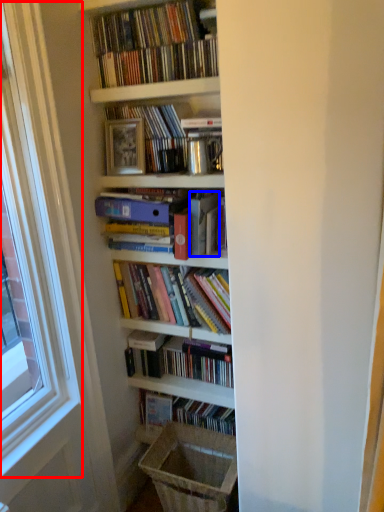
Question: Which of the following is the farthest to the observer, window frame (highlighted by a red box) or paperback book (highlighted by a blue box)?

Choices:
 (A) window frame
 (B) paperback book

Answer: (B)